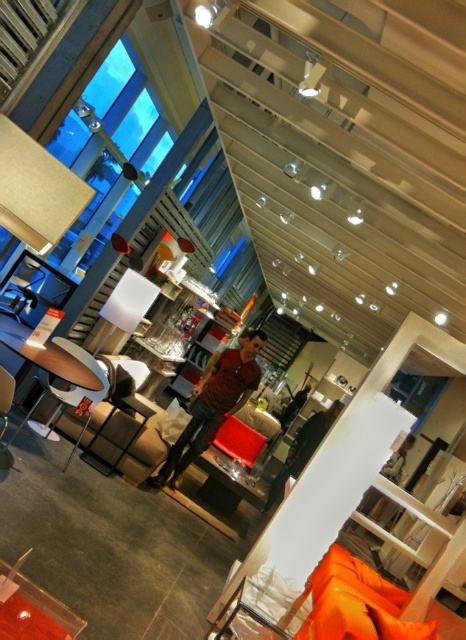
You are a customer in the furniture store and want to place the orange fabric pillow at lower right on the matte black armchair at center. Can you do this based on their positions?

The matte black armchair at center is located above the orange fabric pillow at lower right, so you can place the orange fabric pillow at lower right on the matte black armchair at center since it is positioned below it.